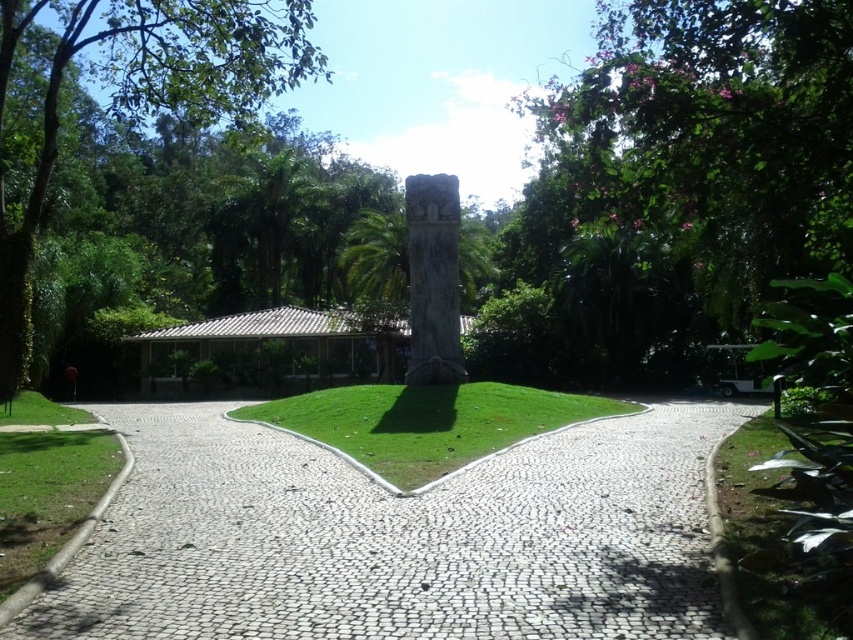
Who is positioned more to the right, white cobblestone path at center or green leafy tree at left?

white cobblestone path at center

Can you confirm if white cobblestone path at center is bigger than green leafy tree at left?

No.

Does point (573, 451) come closer to viewer compared to point (213, 100)?

Yes, it is.

Locate an element on the screen. white cobblestone path at center is located at coordinates (x=396, y=538).

Can you confirm if white cobblestone path at center is smaller than green grass at lower left?

Indeed, white cobblestone path at center has a smaller size compared to green grass at lower left.

Can you confirm if white cobblestone path at center is wider than green grass at lower left?

Indeed, white cobblestone path at center has a greater width compared to green grass at lower left.

I want to click on white cobblestone path at center, so click(396, 538).

This screenshot has width=853, height=640. Identify the location of white cobblestone path at center. (396, 538).

Measure the distance between white cobblestone path at center and green leafy tree at upper right.

A distance of 11.01 meters exists between white cobblestone path at center and green leafy tree at upper right.

This screenshot has width=853, height=640. Describe the element at coordinates (396, 538) in the screenshot. I see `white cobblestone path at center` at that location.

Which is behind, point (334, 605) or point (621, 38)?

Positioned behind is point (621, 38).

The image size is (853, 640). Identify the location of white cobblestone path at center. (396, 538).